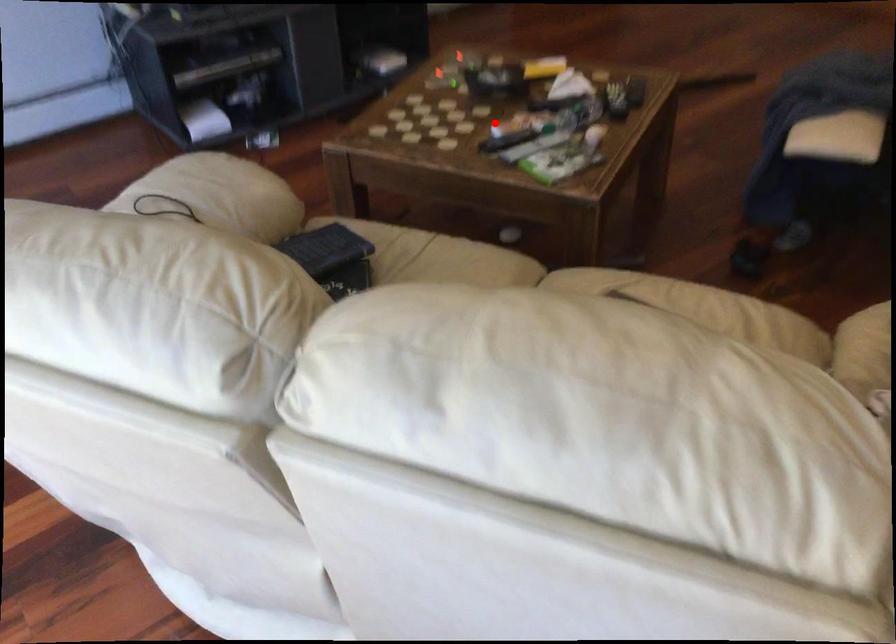
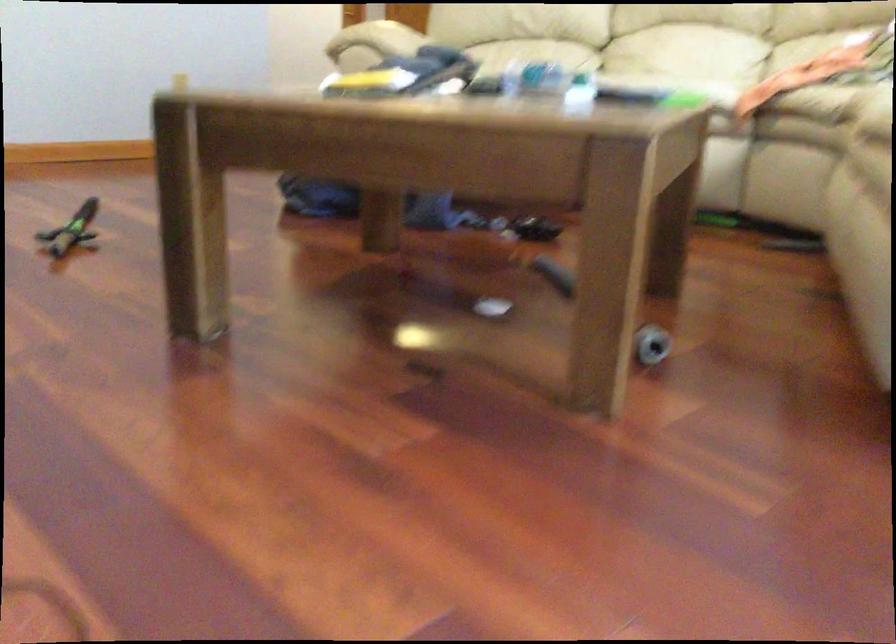
Where in the second image is the point corresponding to the highlighted location from the first image?

(580, 93)